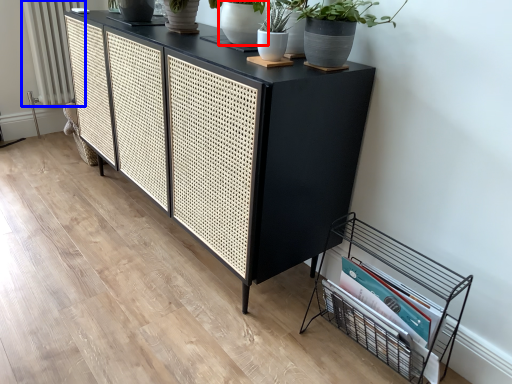
Question: Which object is closer to the camera taking this photo, flowerpot (highlighted by a red box) or radiator (highlighted by a blue box)?

Choices:
 (A) flowerpot
 (B) radiator

Answer: (A)